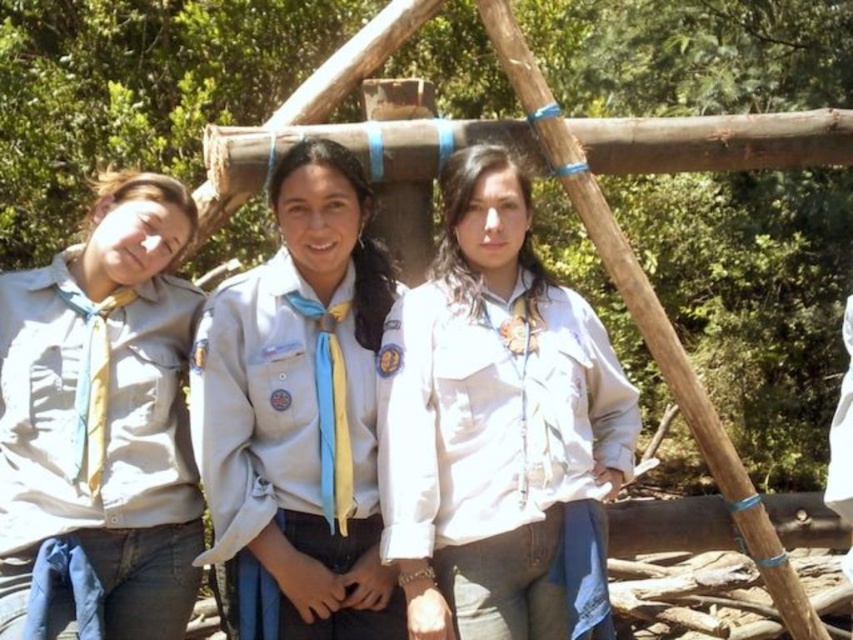
How distant is matte khaki shirt at left from light blue fabric uniform at center?

matte khaki shirt at left is 21.89 inches away from light blue fabric uniform at center.

Does matte khaki shirt at left have a greater height compared to light blue fabric uniform at center?

Yes, matte khaki shirt at left is taller than light blue fabric uniform at center.

Identify the location of matte khaki shirt at left. (97, 444).

This screenshot has height=640, width=853. I want to click on matte khaki shirt at left, so click(97, 444).

Is white matte shirt at center thinner than matte khaki shirt at left?

No, white matte shirt at center is not thinner than matte khaki shirt at left.

Is point (581, 596) farther from camera compared to point (125, 346)?

No, (581, 596) is in front of (125, 346).

Identify the location of white matte shirt at center. (497, 444).

I want to click on white matte shirt at center, so click(x=497, y=444).

Between white matte shirt at center and light blue fabric uniform at center, which one has more height?

light blue fabric uniform at center

Can you confirm if white matte shirt at center is positioned below light blue fabric uniform at center?

Actually, white matte shirt at center is above light blue fabric uniform at center.

Does point (567, 548) come in front of point (376, 330)?

Yes, point (567, 548) is in front of point (376, 330).

Find the location of a particular element. white matte shirt at center is located at coordinates (497, 444).